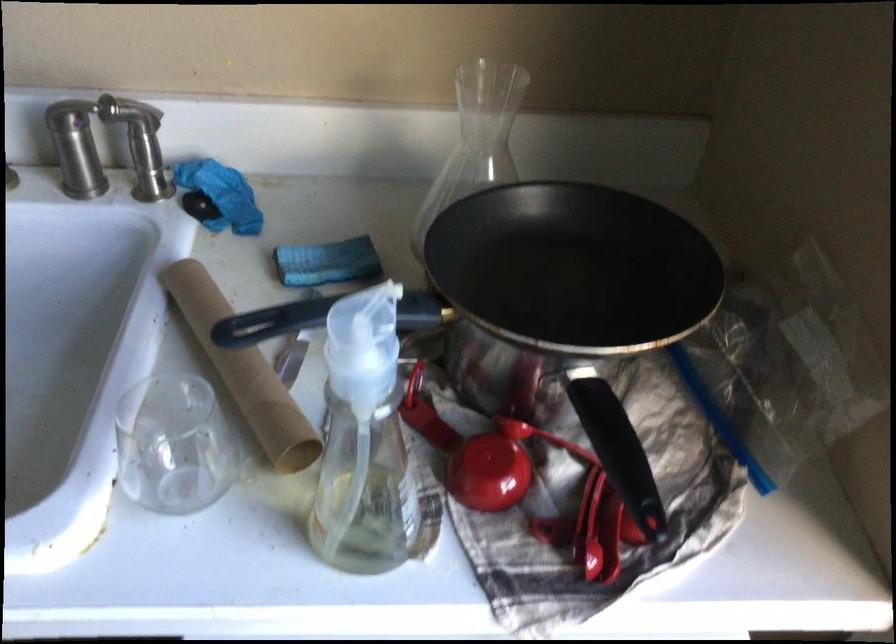
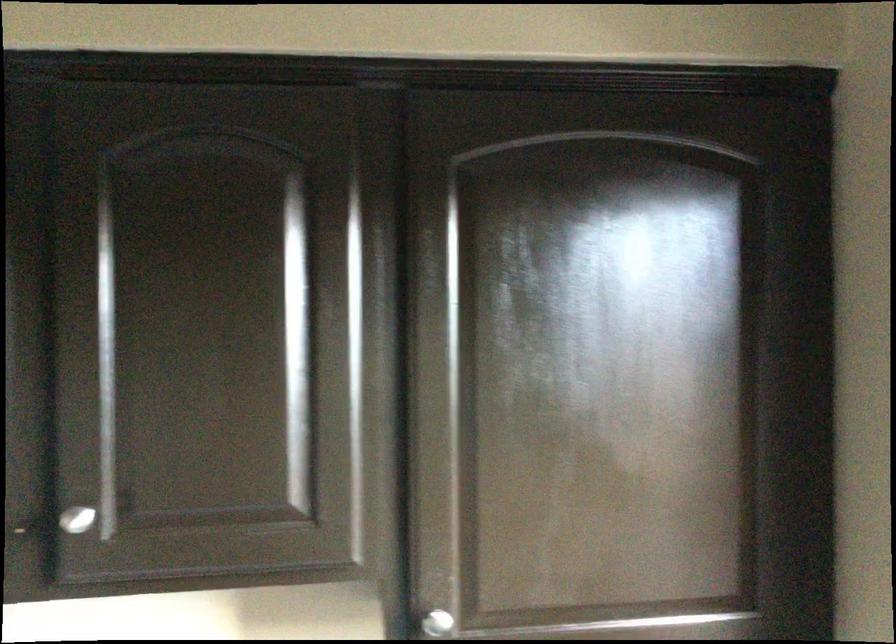
Question: The first image is from the beginning of the video and the second image is from the end. How did the camera likely rotate when shooting the video?

Choices:
 (A) Left
 (B) Right
 (C) Up
 (D) Down

Answer: (C)